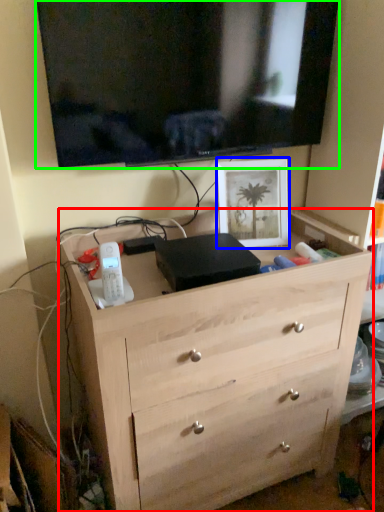
Question: Which object is the closest to the chest of drawers (highlighted by a red box)? Choose among these: picture frame (highlighted by a blue box) or television (highlighted by a green box).

Choices:
 (A) picture frame
 (B) television

Answer: (A)